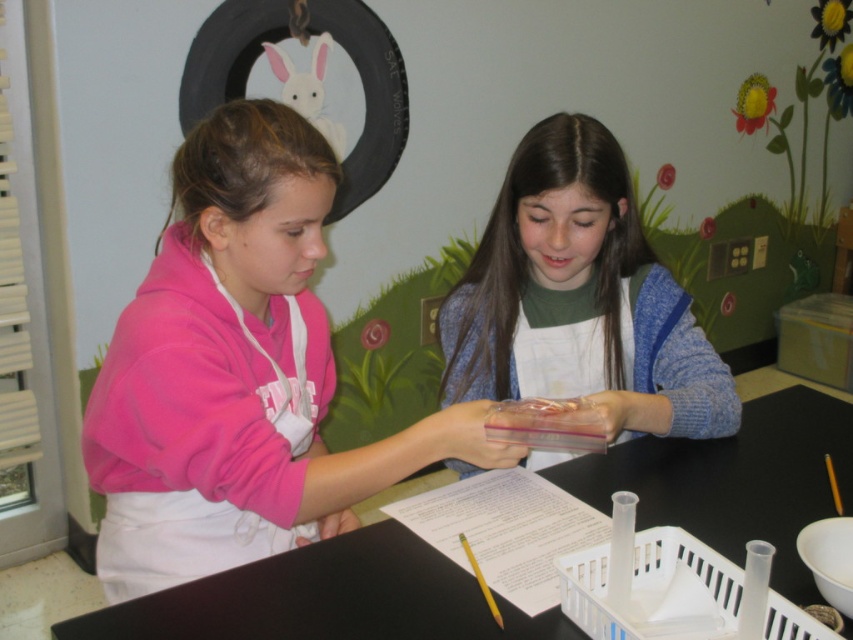
You are a student in the classroom looking at the image. You need to place a small book on the table without it falling off. Where should you place the book relative to the pink fleece jacket at left and the black plastic table at center?

The pink fleece jacket at left is above the black plastic table at center, so placing the book on the table surface below the jacket would ensure it stays on the black plastic table at center.

You are standing 5 feet away from the point at coordinates point (779,550). If you walk straight towards it, how far will you have to walk to reach it?

The distance of point (779,550) from viewer is 3.57 feet. Since you are currently 5 feet away, you need to walk an additional 1.43 feet to reach it.

You are a student in the classroom and want to place a book between the pink fleece jacket at left and the translucent plastic container at center. Is there enough space between them to fit the book?

The pink fleece jacket at left is positioned on the left side of the translucent plastic container at center, so there is space between them to place a book.